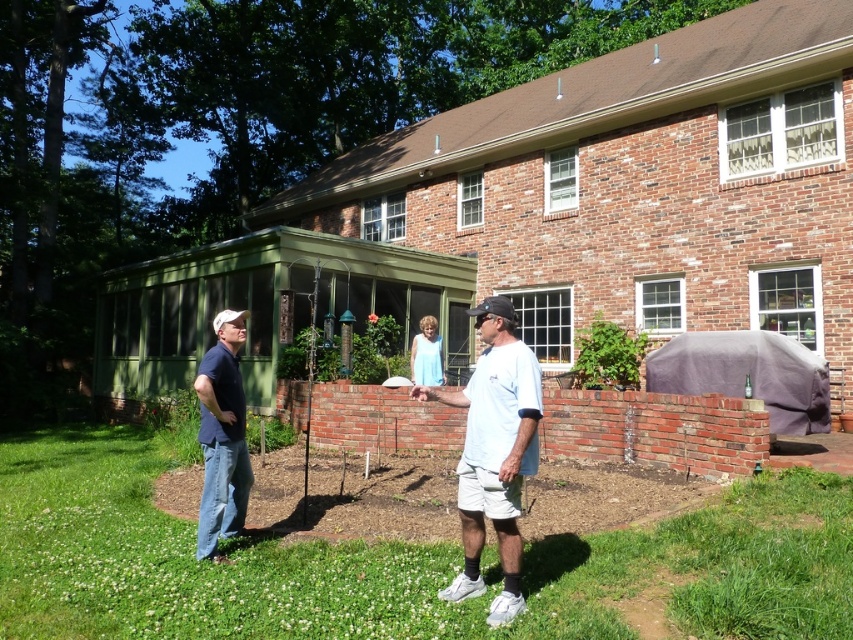
Question: Is light blue dress at center positioned at the back of dark blue shirt at left?

Choices:
 (A) no
 (B) yes

Answer: (A)

Question: Observing the image, what is the correct spatial positioning of white cotton shirt at center in reference to dark blue shirt at left?

Choices:
 (A) below
 (B) above

Answer: (B)

Question: Which point appears farthest from the camera in this image?

Choices:
 (A) (466, 468)
 (B) (335, 564)
 (C) (212, 406)
 (D) (479, 388)

Answer: (C)

Question: Considering the real-world distances, which object is farthest from the white cotton shirt at center?

Choices:
 (A) green grass at lower center
 (B) light blue dress at center
 (C) dark blue shirt at left

Answer: (C)

Question: Which of the following is the farthest from the observer?

Choices:
 (A) (492, 502)
 (B) (810, 628)

Answer: (A)

Question: Is light blue dress at center wider than dark blue shirt at left?

Choices:
 (A) no
 (B) yes

Answer: (B)